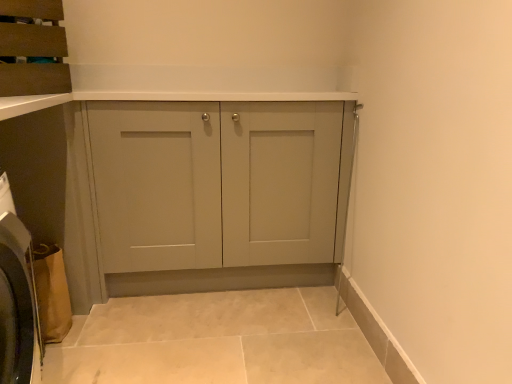
The width and height of the screenshot is (512, 384). I want to click on empty space that is ontop of matte gray cabinet at center (from a real-world perspective), so click(194, 89).